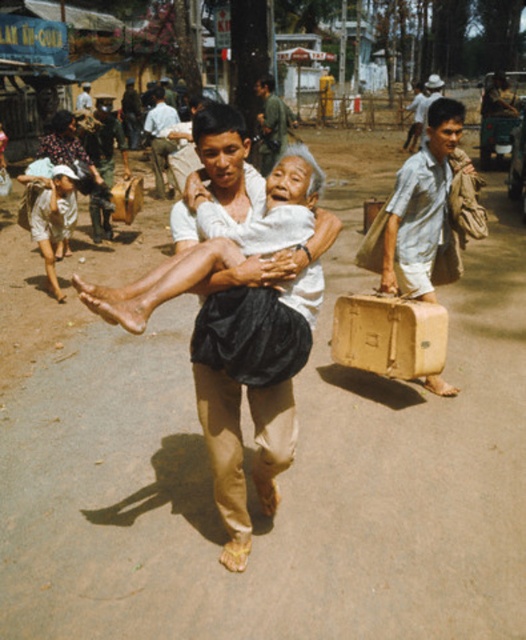
Question: Which of the following is the closest to the observer?

Choices:
 (A) white matte cloth at center
 (B) light blue shirt at center
 (C) beige fabric suitcase at center

Answer: (A)

Question: Observing the image, what is the correct spatial positioning of matte black cloth at center in reference to light blue shirt at center?

Choices:
 (A) above
 (B) below

Answer: (B)

Question: Which point is farther to the camera?

Choices:
 (A) (291, 433)
 (B) (214, 189)

Answer: (A)

Question: Can you confirm if light brown fabric shirt at lower left is positioned below light blue shirt at center?

Choices:
 (A) no
 (B) yes

Answer: (B)

Question: Where is light brown fabric shirt at lower left located in relation to matte black cloth at center in the image?

Choices:
 (A) above
 (B) below

Answer: (B)

Question: Which of the following is the closest to the observer?

Choices:
 (A) khaki pants at center
 (B) white matte cloth at center
 (C) beige fabric suitcase at center
 (D) light blue shirt at center

Answer: (B)